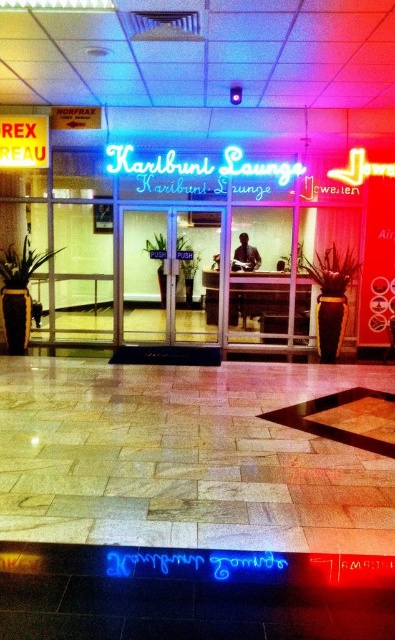
You are standing at the entrance of Karibuni Lounge and want to enter. Where are the transparent glass doors at center located relative to your position?

The transparent glass doors at center are located at point (167, 275) relative to your position.

You are standing at the entrance of Karibuni Lounge and want to take a photo of both the neon sign and the man behind the counter. If you focus your camera on point point (163,310) and point (161,163), which point should you focus on first to ensure both are in focus?

You should focus on point (161,163) first because it is closer to you than point (163,310), which is further away. This way, the camera can adjust the focus to capture both points clearly.

You are a delivery person approaching the entrance of Karibuni Lounge. You need to deliver a package to the reception desk inside. The doors are locked, but you notice the transparent glass doors at center and the neon sign at center. Which object should you interact with to enter?

You should interact with the transparent glass doors at center to enter, as they are the larger object compared to the neon sign at center and likely the entrance point.